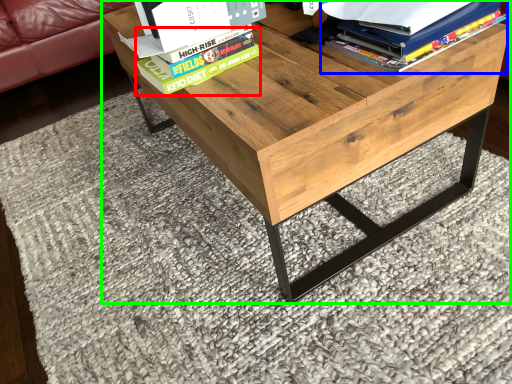
Question: Estimate the real-world distances between objects in this image. Which object is farther from paperback book (highlighted by a red box), book (highlighted by a blue box) or table (highlighted by a green box)?

Choices:
 (A) book
 (B) table

Answer: (A)